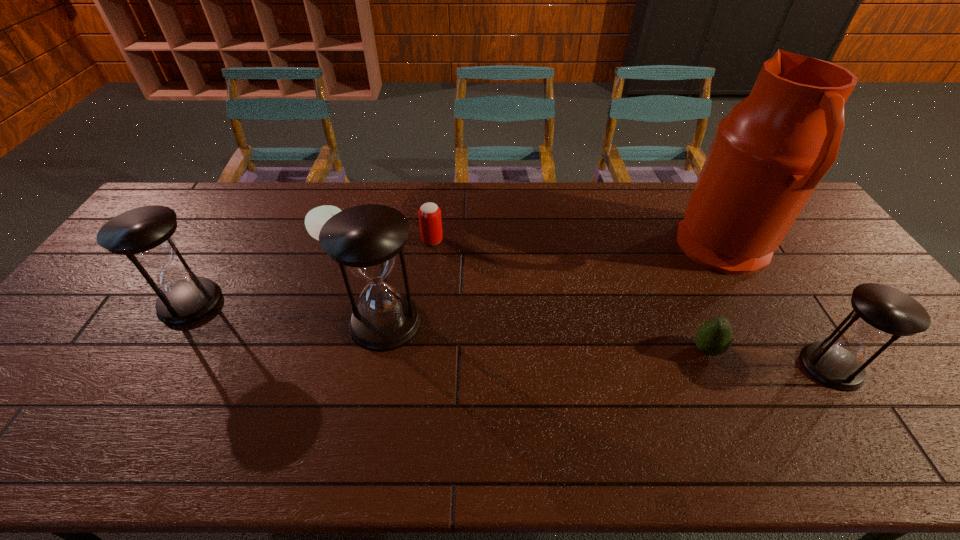
Please mark a free spot for a new hourglass to balance the arrangement. Please provide its 2D coordinates. Your answer should be formatted as a tuple, i.e. [(x, y)], where the tuple contains the x and y coordinates of a point satisfying the conditions above.

[(599, 343)]